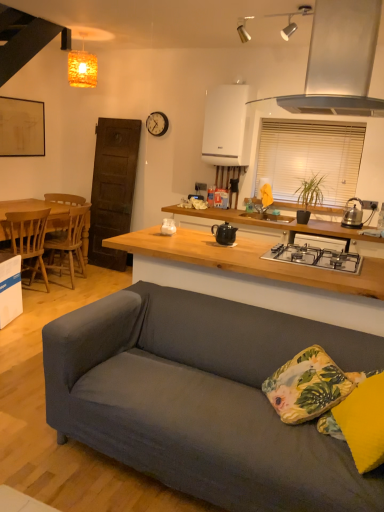
Locate an element on the screen. vacant space situated on the left part of black ceramic teapot at center is located at coordinates (201, 239).